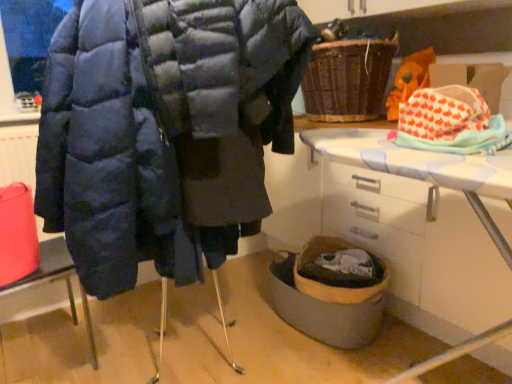
I want to click on free space in front of wooden woven basket at lower center, so pos(332,367).